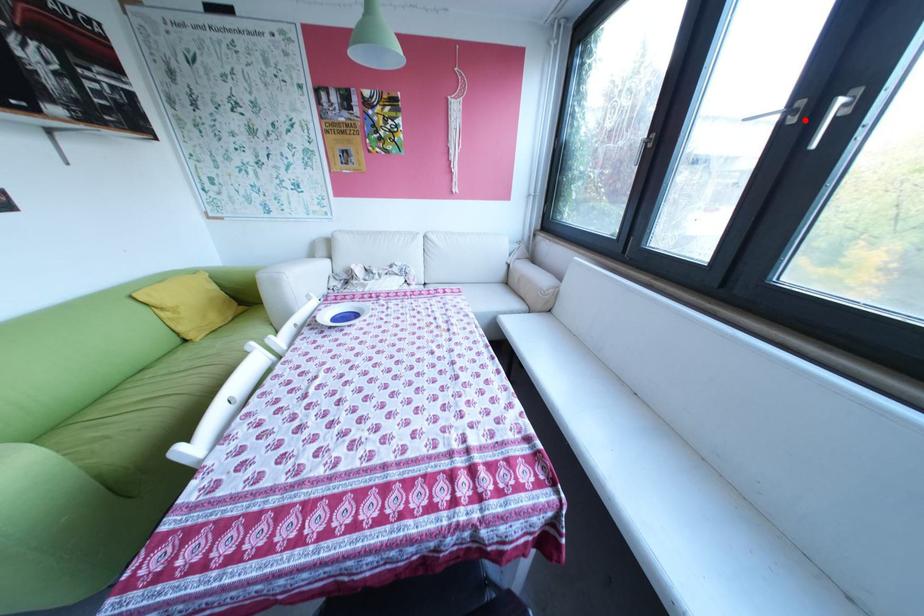
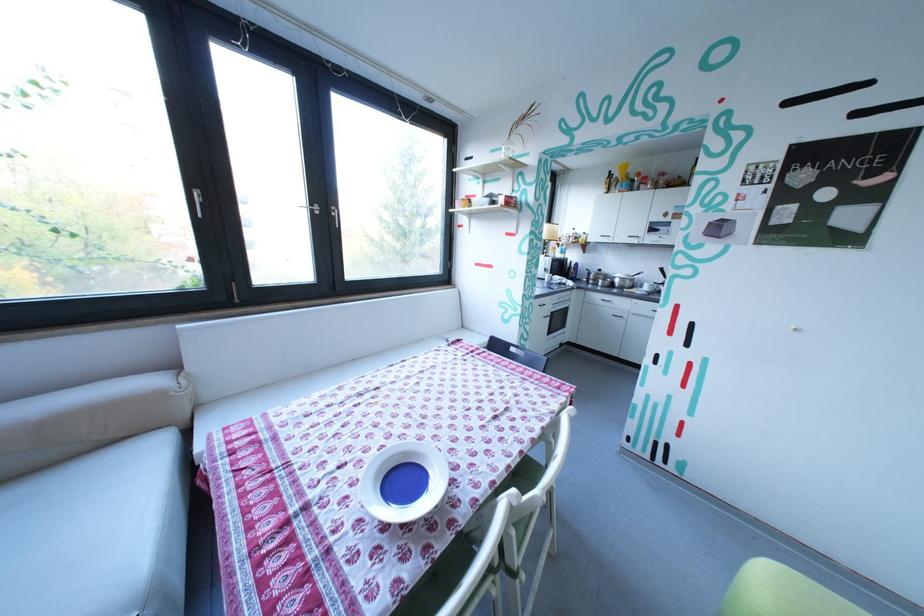
Find the pixel in the second image that matches the highlighted location in the first image.

(331, 213)